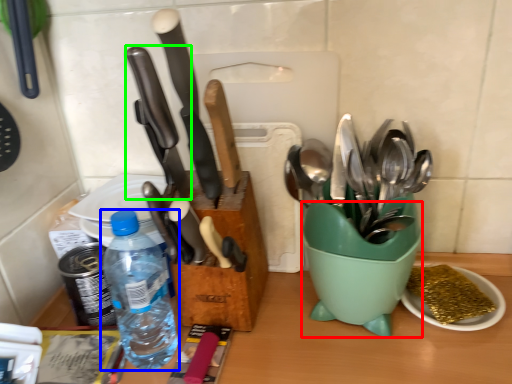
Question: Which is farther away from mixing bowl (highlighted by a red box)? bottle (highlighted by a blue box) or kitchen knife (highlighted by a green box)?

Choices:
 (A) bottle
 (B) kitchen knife

Answer: (A)